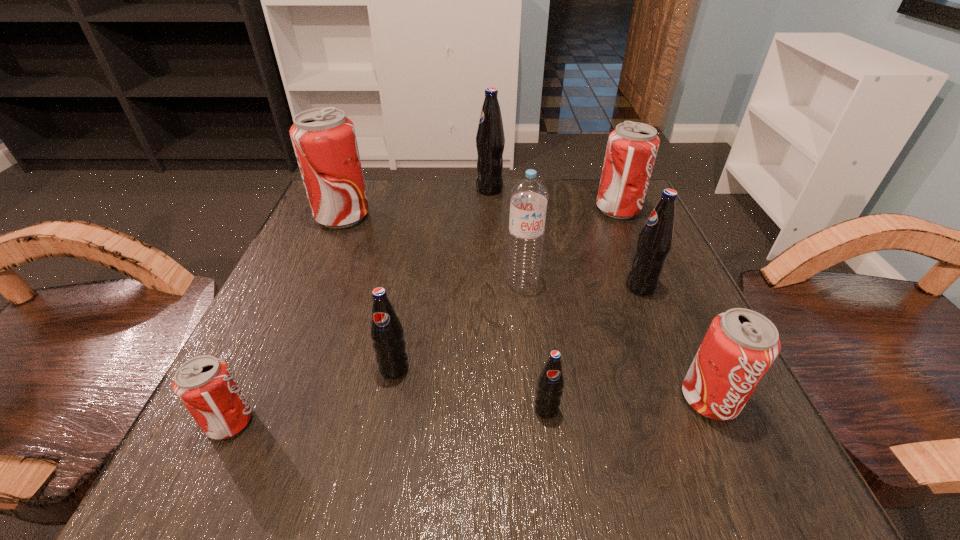
At what (x,y) coordinates should I click in order to perform the action: click on the second closest black pop relative to the second smallest pink soda can. Please return your answer as a coordinate pair (x, y). Looking at the image, I should click on (550, 383).

Select which pink soda can appears as the fourth closest to the water bottle. Please provide its 2D coordinates. Your answer should be formatted as a tuple, i.e. [(x, y)], where the tuple contains the x and y coordinates of a point satisfying the conditions above.

[(205, 385)]

Identify the location of pink soda can object that ranks as the third closest to the biggest pink soda can. Image resolution: width=960 pixels, height=540 pixels. (740, 346).

At what (x,y) coordinates should I click in order to perform the action: click on vacant space that satisfies the following two spatial constraints: 1. on the front label of the water bottle; 2. on the right side of the fifth pop from right to left. Please return your answer as a coordinate pair (x, y). This screenshot has height=540, width=960. Looking at the image, I should click on (492, 282).